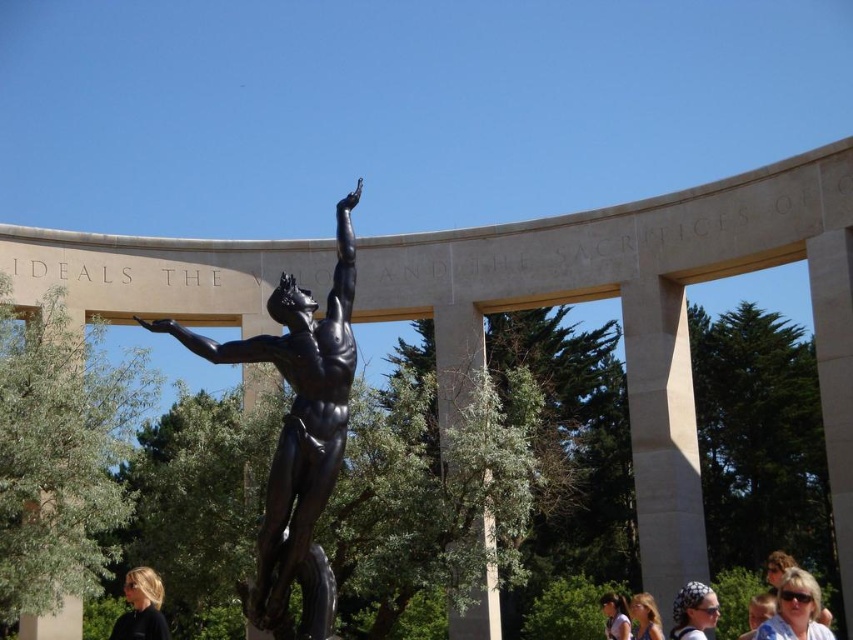
Is point (291, 312) in front of point (695, 621)?

Yes, point (291, 312) is in front of point (695, 621).

Who is more forward, (x=347, y=276) or (x=688, y=605)?

Positioned in front is point (x=347, y=276).

Locate an element on the screen. Image resolution: width=853 pixels, height=640 pixels. bronze statue at center is located at coordinates (297, 433).

The height and width of the screenshot is (640, 853). In order to click on matte black sunglasses at lower right in this screenshot , I will do `click(795, 609)`.

Who is lower down, matte black sunglasses at lower right or matte black hair at lower left?

Positioned lower is matte black hair at lower left.

Image resolution: width=853 pixels, height=640 pixels. In order to click on matte black sunglasses at lower right in this screenshot , I will do `click(795, 609)`.

Consider the image. Who is positioned more to the left, matte black sunglasses at lower right or matte black hair at lower right?

Positioned to the left is matte black hair at lower right.

Between matte black sunglasses at lower right and matte black hair at lower right, which one is positioned higher?

Positioned higher is matte black sunglasses at lower right.

Is point (819, 592) positioned after point (634, 598)?

No, (819, 592) is closer to viewer.

Image resolution: width=853 pixels, height=640 pixels. I want to click on matte black sunglasses at lower right, so [795, 609].